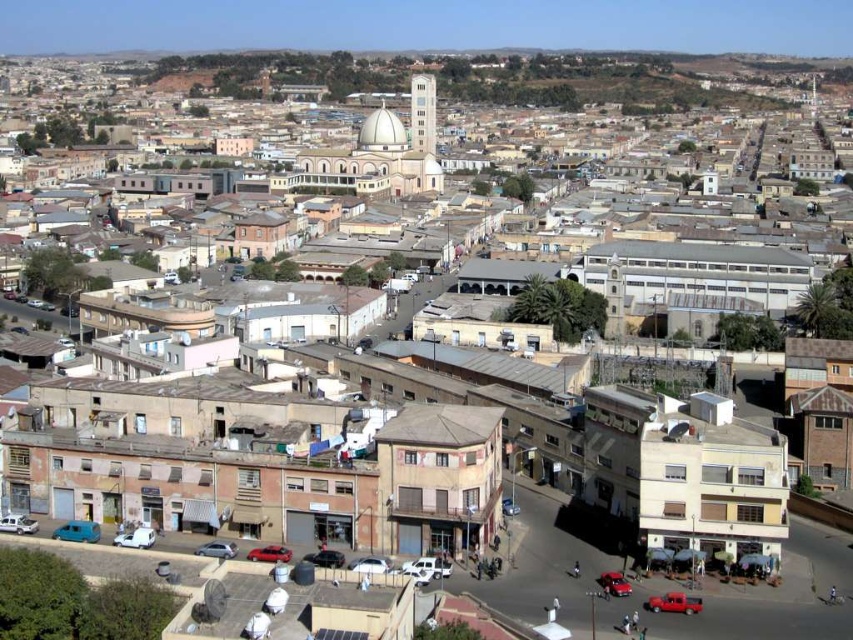
You are a delivery person who needs to park your 2.5 meter wide truck between the matte blue van at lower left and the white matte car at lower left. Is there enough space for your truck to fit between them?

The distance between the matte blue van at lower left and the white matte car at lower left is 4.69 meters, which is wider than the truck width of 2.5 meters. Therefore, the truck can fit between them.

You are a delivery driver who needs to park your vehicle in a tight space between two buildings. You have a metallic red pickup truck at lower right and a white matte van at lower left. Which vehicle should you choose to ensure it fits in the narrow parking spot?

The white matte van at lower left is smaller than the metallic red pickup truck at lower right, so it would be more likely to fit in the narrow parking spot.

You are a delivery driver who needs to park your vehicle in a tight space between two buildings. You have a metallic red pickup truck at lower right and a white matte car at lower left. Which vehicle would be easier to maneuver into the narrow space?

The white matte car at lower left would be easier to maneuver into the narrow space since it is narrower than the metallic red pickup truck at lower right.